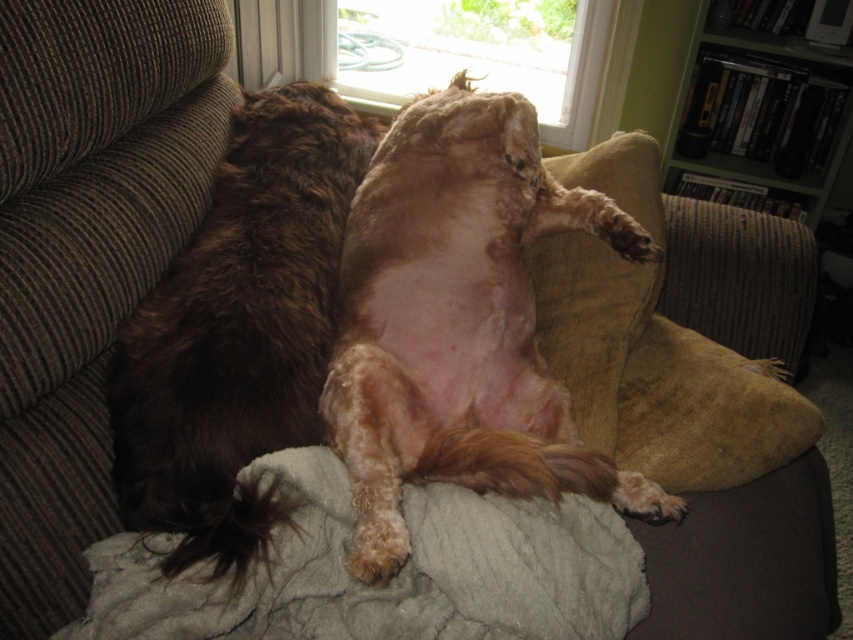
Question: Does brown corduroy pillow at left have a larger size compared to green wood bookshelf at upper right?

Choices:
 (A) yes
 (B) no

Answer: (B)

Question: Where is brown fluffy dog at left located in relation to suede cushion at lower right in the image?

Choices:
 (A) right
 (B) left

Answer: (B)

Question: Can you confirm if beige fabric pillow at center is thinner than transparent glass window at upper center?

Choices:
 (A) yes
 (B) no

Answer: (A)

Question: Based on their relative distances, which object is nearer to the brown corduroy pillow at left?

Choices:
 (A) brown fluffy dog at left
 (B) fuzzy brown dog at center
 (C) green wood bookshelf at upper right
 (D) transparent glass window at upper center

Answer: (A)

Question: Which point appears farthest from the camera in this image?

Choices:
 (A) (743, 170)
 (B) (577, 164)
 (C) (80, 330)
 (D) (508, 244)

Answer: (A)

Question: Which is nearer to the soft gray blanket at center?

Choices:
 (A) fuzzy brown dog at center
 (B) brown corduroy pillow at left
 (C) suede cushion at lower right

Answer: (A)